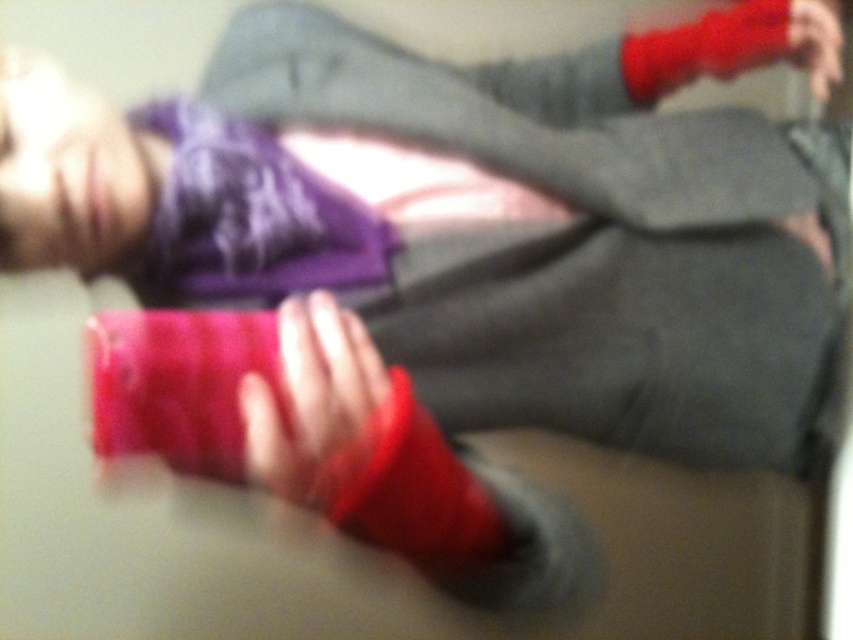
Between matte red sock at center and matte red sock at upper right, which one has less height?

matte red sock at center

Looking at this image, can you confirm if matte red sock at center is bigger than matte red sock at upper right?

No.

Who is more distant from viewer, (306, 326) or (811, 65)?

Positioned behind is point (811, 65).

The width and height of the screenshot is (853, 640). In order to click on matte red sock at center in this screenshot , I will do `click(311, 400)`.

Between matte gray pants at center and matte red sock at center, which one has less height?

matte red sock at center

Which is below, matte gray pants at center or matte red sock at center?

Positioned lower is matte red sock at center.

Is point (660, 323) closer to viewer compared to point (363, 454)?

No.

This screenshot has height=640, width=853. I want to click on matte gray pants at center, so click(x=581, y=244).

Can you confirm if matte gray pants at center is thinner than matte red sock at upper right?

In fact, matte gray pants at center might be wider than matte red sock at upper right.

Between matte gray pants at center and matte red sock at upper right, which one is positioned higher?

Positioned higher is matte red sock at upper right.

At what (x,y) coordinates should I click in order to perform the action: click on matte gray pants at center. Please return your answer as a coordinate pair (x, y). Looking at the image, I should click on (581, 244).

Find the location of a particular element. This screenshot has width=853, height=640. matte gray pants at center is located at coordinates (581, 244).